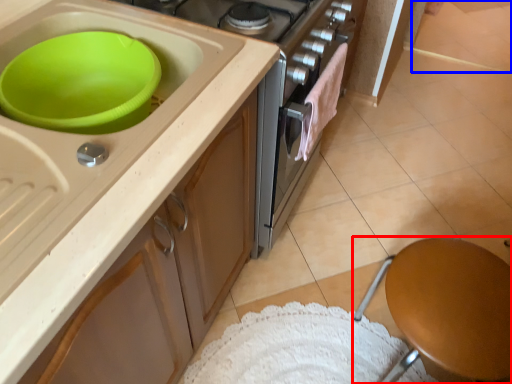
Question: Which object is further to the camera taking this photo, furniture (highlighted by a red box) or tile (highlighted by a blue box)?

Choices:
 (A) furniture
 (B) tile

Answer: (B)